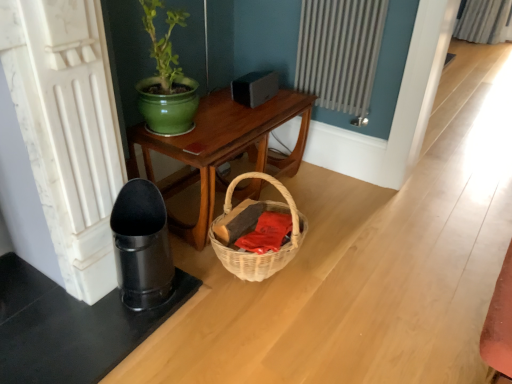
Question: Is white textured radiator at upper center placed right next to green ceramic pot at upper center?

Choices:
 (A) no
 (B) yes

Answer: (A)

Question: Is white textured radiator at upper center closer to the viewer compared to green ceramic pot at upper center?

Choices:
 (A) yes
 (B) no

Answer: (B)

Question: Considering the relative sizes of white textured radiator at upper center and green ceramic pot at upper center in the image provided, is white textured radiator at upper center shorter than green ceramic pot at upper center?

Choices:
 (A) yes
 (B) no

Answer: (B)

Question: From a real-world perspective, is white textured radiator at upper center physically above green ceramic pot at upper center?

Choices:
 (A) yes
 (B) no

Answer: (B)

Question: Considering the relative positions of white textured radiator at upper center and green ceramic pot at upper center in the image provided, is white textured radiator at upper center to the left of green ceramic pot at upper center from the viewer's perspective?

Choices:
 (A) no
 (B) yes

Answer: (A)

Question: Is white textured radiator at upper center aimed at green ceramic pot at upper center?

Choices:
 (A) no
 (B) yes

Answer: (B)

Question: Does green ceramic pot at upper center have a larger size compared to woven wood table at center?

Choices:
 (A) no
 (B) yes

Answer: (A)

Question: Can you confirm if green ceramic pot at upper center is positioned to the right of woven wood table at center?

Choices:
 (A) no
 (B) yes

Answer: (A)

Question: Does green ceramic pot at upper center have a greater height compared to woven wood table at center?

Choices:
 (A) no
 (B) yes

Answer: (B)

Question: Is green ceramic pot at upper center completely or partially outside of woven wood table at center?

Choices:
 (A) yes
 (B) no

Answer: (A)

Question: Is green ceramic pot at upper center aimed at woven wood table at center?

Choices:
 (A) yes
 (B) no

Answer: (B)

Question: Does green ceramic pot at upper center have a smaller size compared to woven wood table at center?

Choices:
 (A) yes
 (B) no

Answer: (A)

Question: Is white textured radiator at upper center at the right side of woven wood table at center?

Choices:
 (A) yes
 (B) no

Answer: (A)